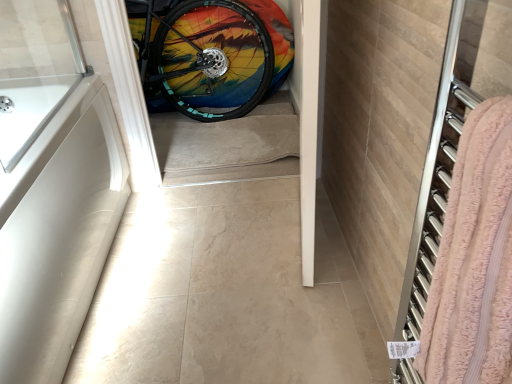
Question: Does rainbow painted tire at center have a larger size compared to white matte bathtub at left?

Choices:
 (A) yes
 (B) no

Answer: (B)

Question: Is rainbow painted tire at center smaller than white matte bathtub at left?

Choices:
 (A) no
 (B) yes

Answer: (B)

Question: Is rainbow painted tire at center at the right side of white matte bathtub at left?

Choices:
 (A) no
 (B) yes

Answer: (B)

Question: Is rainbow painted tire at center positioned before white matte bathtub at left?

Choices:
 (A) no
 (B) yes

Answer: (A)

Question: Is rainbow painted tire at center in contact with white matte bathtub at left?

Choices:
 (A) no
 (B) yes

Answer: (A)

Question: In the image, is rainbow painted tire at center positioned in front of or behind white matte bathtub at left?

Choices:
 (A) behind
 (B) front

Answer: (A)

Question: Considering the relative positions of rainbow painted tire at center and white matte bathtub at left in the image provided, is rainbow painted tire at center to the left or to the right of white matte bathtub at left?

Choices:
 (A) left
 (B) right

Answer: (B)

Question: Considering the positions of rainbow painted tire at center and white matte bathtub at left in the image, is rainbow painted tire at center bigger or smaller than white matte bathtub at left?

Choices:
 (A) small
 (B) big

Answer: (A)

Question: From the image's perspective, is rainbow painted tire at center above or below white matte bathtub at left?

Choices:
 (A) below
 (B) above

Answer: (B)

Question: From a real-world perspective, is rainbow painted tire at center above or below pink terry cloth towel at right?

Choices:
 (A) above
 (B) below

Answer: (B)

Question: In terms of height, does rainbow painted tire at center look taller or shorter compared to pink terry cloth towel at right?

Choices:
 (A) short
 (B) tall

Answer: (B)

Question: Is rainbow painted tire at center wider or thinner than pink terry cloth towel at right?

Choices:
 (A) thin
 (B) wide

Answer: (B)

Question: In the image, is rainbow painted tire at center positioned in front of or behind pink terry cloth towel at right?

Choices:
 (A) behind
 (B) front

Answer: (A)

Question: Would you say white matte bathtub at left is inside or outside rainbow painted tire at center?

Choices:
 (A) outside
 (B) inside

Answer: (A)

Question: From their relative heights in the image, would you say white matte bathtub at left is taller or shorter than rainbow painted tire at center?

Choices:
 (A) tall
 (B) short

Answer: (B)